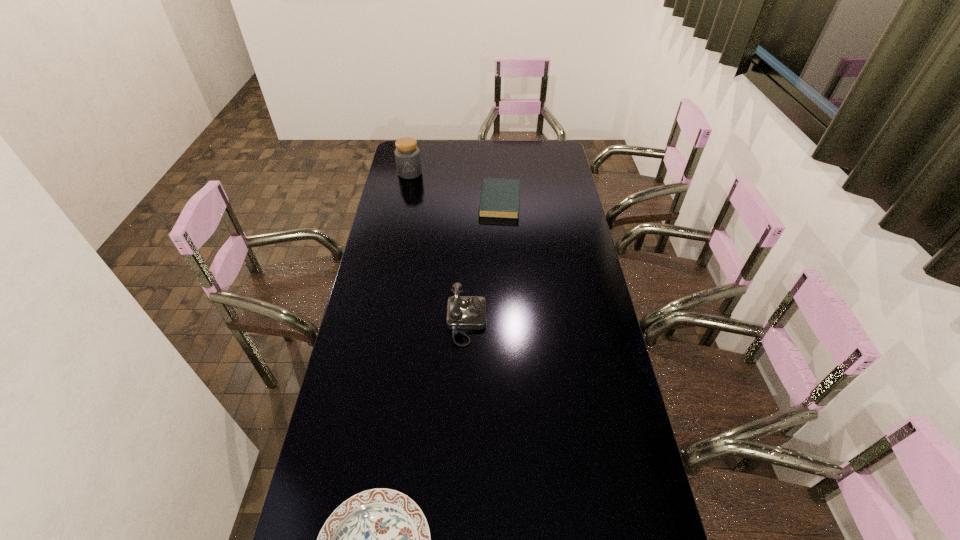
Where is `vacant space that satisfies the following two spatial constraints: 1. on the surface of the tallest object near the warning symbol; 2. on the right side of the book`? This screenshot has height=540, width=960. vacant space that satisfies the following two spatial constraints: 1. on the surface of the tallest object near the warning symbol; 2. on the right side of the book is located at coordinates (404, 201).

Find the location of a particular element. The width and height of the screenshot is (960, 540). vacant region that satisfies the following two spatial constraints: 1. on the surface of the book near the warning symbol; 2. on the left side of the farthest object is located at coordinates (404, 201).

Identify the location of vacant space that satisfies the following two spatial constraints: 1. on the surface of the third nearest object near the warning symbol; 2. on the right side of the jar. The width and height of the screenshot is (960, 540). (404, 201).

Locate an element on the screen. This screenshot has height=540, width=960. free location that satisfies the following two spatial constraints: 1. on the surface of the tallest object near the warning symbol; 2. on the left side of the second farthest object is located at coordinates (404, 201).